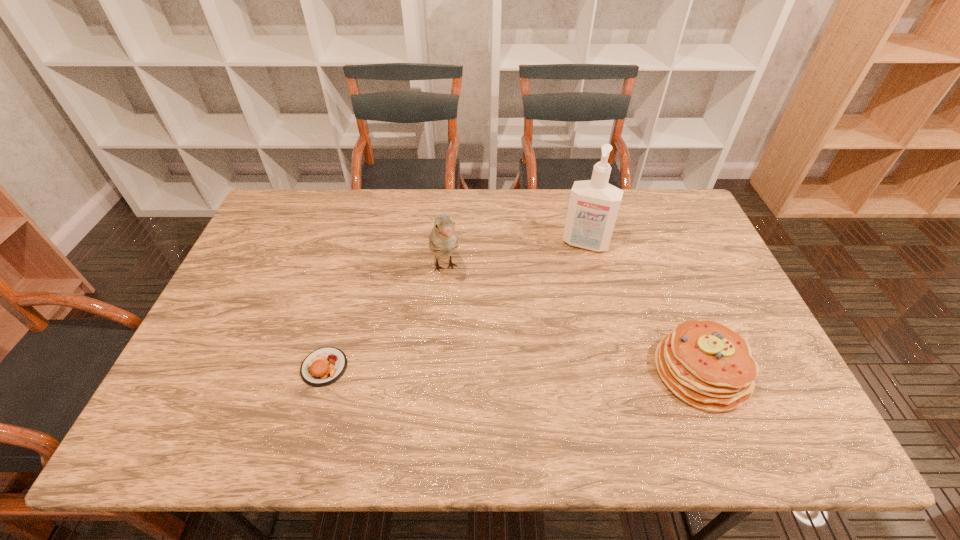
This screenshot has width=960, height=540. In order to click on vacant area situated 0.340m on the front label of the cleansing agent in this screenshot , I will do `click(553, 338)`.

The height and width of the screenshot is (540, 960). I want to click on vacant space situated 0.230m on the front label of the cleansing agent, so click(x=564, y=307).

Locate an element on the screen. This screenshot has width=960, height=540. vacant space located 0.100m on the front label of the cleansing agent is located at coordinates click(x=573, y=275).

Where is `free location located at the face of the bird`? This screenshot has height=540, width=960. free location located at the face of the bird is located at coordinates (455, 310).

Locate an element on the screen. The height and width of the screenshot is (540, 960). free space located 0.070m at the face of the bird is located at coordinates point(454,308).

Identify the location of free spot located at the face of the bird. (455, 310).

This screenshot has width=960, height=540. I want to click on object that is at the far edge, so click(593, 207).

Identify the location of patty (food) that is positioned at the near edge. The height and width of the screenshot is (540, 960). coord(324,366).

Where is `pancake that is positioned at the near edge`? pancake that is positioned at the near edge is located at coordinates (707, 365).

Locate an element on the screen. This screenshot has width=960, height=540. object that is at the right edge is located at coordinates (707, 365).